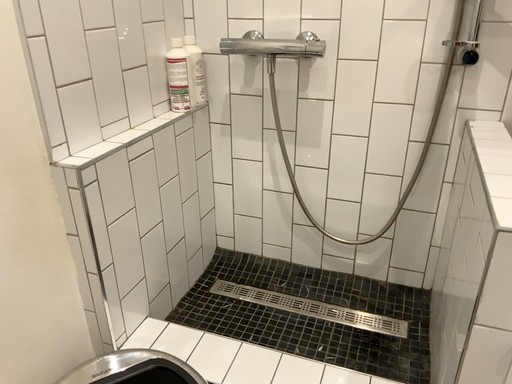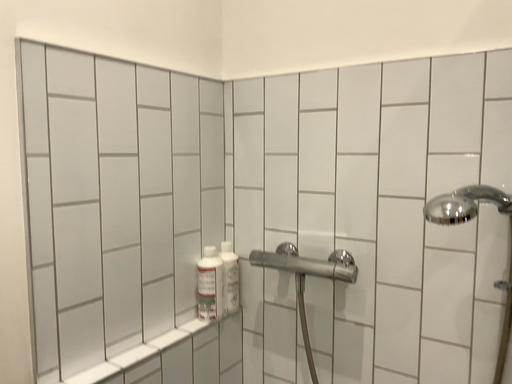
Question: Which way did the camera rotate in the video?

Choices:
 (A) rotated downward
 (B) rotated upward

Answer: (B)